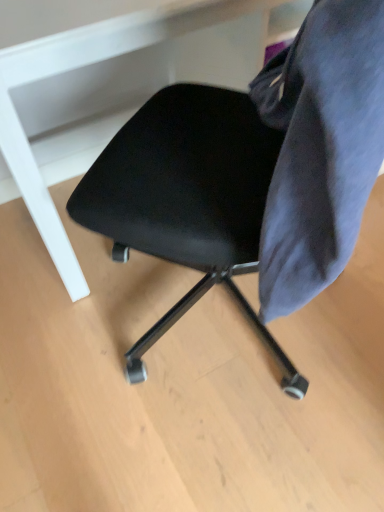
Question: From a real-world perspective, is black leather chair at center on velvet dark blue chair at right?

Choices:
 (A) no
 (B) yes

Answer: (A)

Question: Can you see black leather chair at center touching velvet dark blue chair at right?

Choices:
 (A) yes
 (B) no

Answer: (B)

Question: Is black leather chair at center shorter than velvet dark blue chair at right?

Choices:
 (A) no
 (B) yes

Answer: (A)

Question: Does black leather chair at center appear on the left side of velvet dark blue chair at right?

Choices:
 (A) yes
 (B) no

Answer: (A)

Question: Can you confirm if black leather chair at center is smaller than velvet dark blue chair at right?

Choices:
 (A) yes
 (B) no

Answer: (B)

Question: Considering the positions of black matte chair at center and black leather chair at center in the image, is black matte chair at center bigger or smaller than black leather chair at center?

Choices:
 (A) big
 (B) small

Answer: (A)

Question: Relative to black leather chair at center, is black matte chair at center in front or behind?

Choices:
 (A) behind
 (B) front

Answer: (A)

Question: From the image's perspective, is black matte chair at center above or below black leather chair at center?

Choices:
 (A) above
 (B) below

Answer: (A)

Question: From their relative heights in the image, would you say black matte chair at center is taller or shorter than black leather chair at center?

Choices:
 (A) short
 (B) tall

Answer: (A)

Question: Is velvet dark blue chair at right to the left or to the right of black leather chair at center in the image?

Choices:
 (A) left
 (B) right

Answer: (B)

Question: Is point (289, 285) positioned closer to the camera than point (193, 157)?

Choices:
 (A) closer
 (B) farther

Answer: (A)

Question: Is velvet dark blue chair at right spatially inside black leather chair at center, or outside of it?

Choices:
 (A) outside
 (B) inside

Answer: (B)

Question: Looking at the image, does velvet dark blue chair at right seem bigger or smaller compared to black leather chair at center?

Choices:
 (A) small
 (B) big

Answer: (A)

Question: In terms of height, does velvet dark blue chair at right look taller or shorter compared to black matte chair at center?

Choices:
 (A) short
 (B) tall

Answer: (A)

Question: Considering the relative positions of velvet dark blue chair at right and black matte chair at center in the image provided, is velvet dark blue chair at right to the left or to the right of black matte chair at center?

Choices:
 (A) left
 (B) right

Answer: (B)